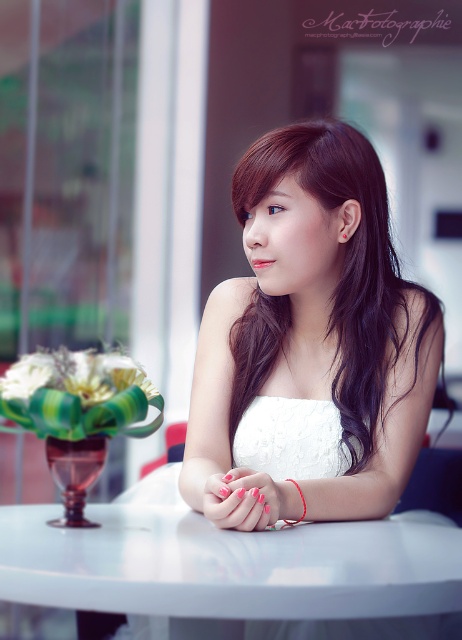
You are a waiter in a restaurant. You need to place a small dessert plate on the table. The plate is 10 cm in diameter. The red string bracelet at center is currently on the left wrist of the customer. Can you place the dessert plate on the white glossy table at center without it overlapping the bracelet?

The white glossy table at center is to the left of the red string bracelet at center, meaning the bracelet is on the right side of the table. Since the plate is only 10 cm wide, placing it on the left side of the table away from the bracelet would avoid overlap.

You are a photographer trying to capture the best angle of the scene. You notice two points in the image at coordinates point (x=255, y=148) and point (x=304, y=504). Which point is closer to your camera lens?

Point (x=255, y=148) is further to the viewer than point (x=304, y=504), so the point closer to the camera lens would be point (x=255, y=148).